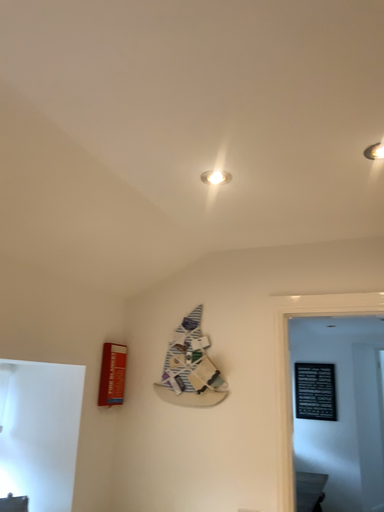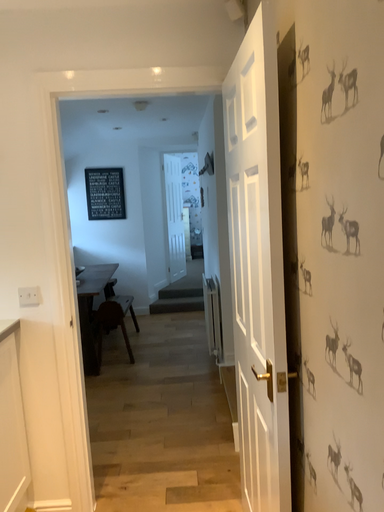
Question: How did the camera likely rotate when shooting the video?

Choices:
 (A) rotated left
 (B) rotated right

Answer: (B)